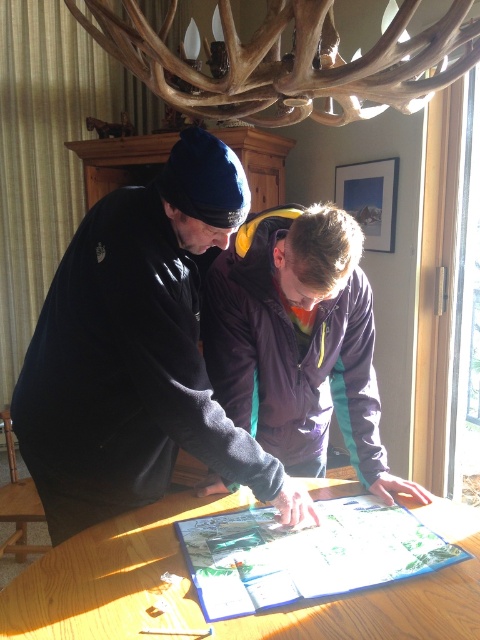
Question: Which point is farther to the camera?

Choices:
 (A) dark blue fleece jacket at center
 (B) wooden table at center
 (C) purple fleece jacket at center

Answer: (C)

Question: Does dark blue fleece jacket at center appear over wooden table at center?

Choices:
 (A) yes
 (B) no

Answer: (A)

Question: Which object is farther from the camera taking this photo?

Choices:
 (A) dark blue fleece jacket at center
 (B) purple fleece jacket at center

Answer: (B)

Question: Which object is the closest to the wooden table at center?

Choices:
 (A) dark blue fleece jacket at center
 (B) purple fleece jacket at center

Answer: (B)

Question: Is dark blue fleece jacket at center below purple fleece jacket at center?

Choices:
 (A) no
 (B) yes

Answer: (A)

Question: Can you confirm if dark blue fleece jacket at center is positioned to the left of wooden table at center?

Choices:
 (A) no
 (B) yes

Answer: (B)